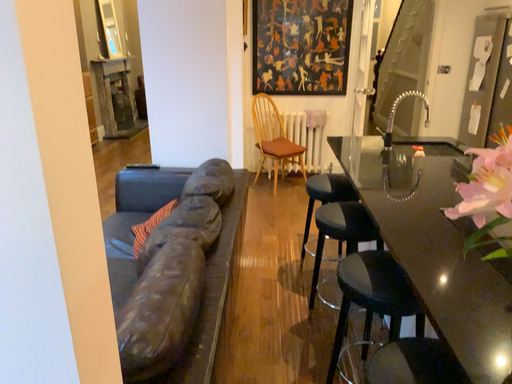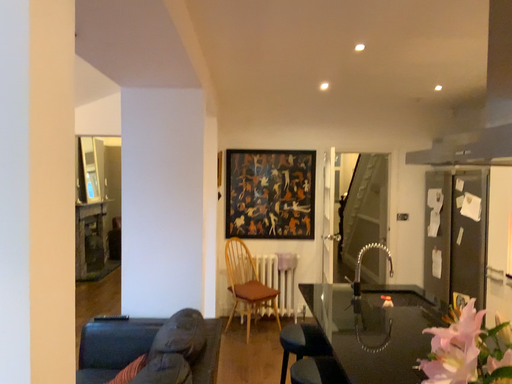
Question: How did the camera likely rotate when shooting the video?

Choices:
 (A) rotated downward
 (B) rotated upward

Answer: (B)